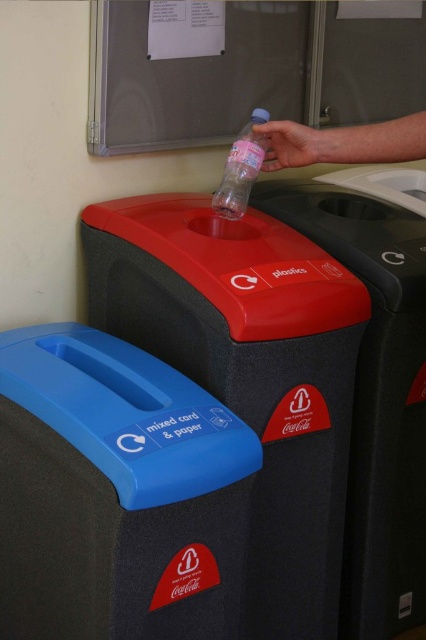
Question: Considering the relative positions of blue plastic mixed card & paper at upper left and clear plastic bottle at upper center in the image provided, where is blue plastic mixed card & paper at upper left located with respect to clear plastic bottle at upper center?

Choices:
 (A) right
 (B) left

Answer: (B)

Question: Which object is farther from the camera taking this photo?

Choices:
 (A) red plastic recycling bin at upper center
 (B) red plastic bin at center

Answer: (B)

Question: Which of the following is the farthest from the observer?

Choices:
 (A) (132, 444)
 (B) (121, 240)

Answer: (B)

Question: Where is blue plastic mixed card & paper at upper left located in relation to red plastic recycling bin at upper center in the image?

Choices:
 (A) above
 (B) below

Answer: (B)

Question: Estimate the real-world distances between objects in this image. Which object is farther from the blue plastic mixed card & paper at upper left?

Choices:
 (A) red plastic bin at center
 (B) pink matte plastic bottle at upper center
 (C) red plastic recycling bin at upper center

Answer: (B)

Question: Can you confirm if red plastic recycling bin at upper center is positioned to the right of pink matte plastic bottle at upper center?

Choices:
 (A) no
 (B) yes

Answer: (A)